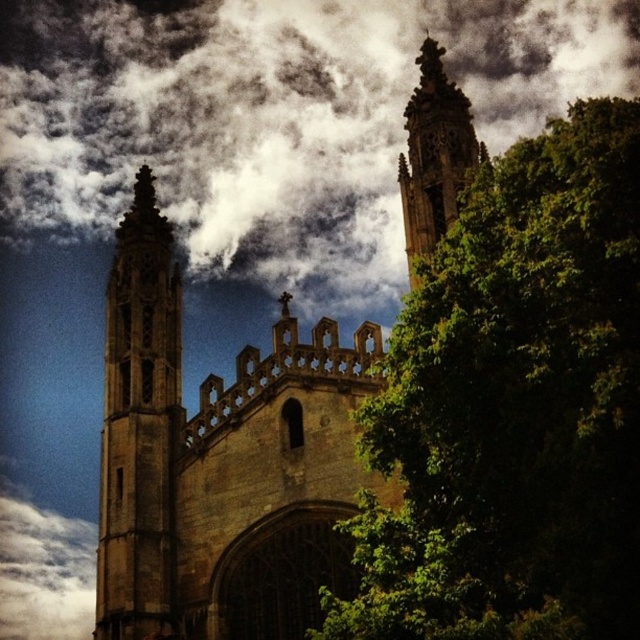
Question: Is white fluffy cloud at upper center bigger than green leafy tree at right?

Choices:
 (A) yes
 (B) no

Answer: (B)

Question: Is brown stone church at center positioned before brown stone tower at left?

Choices:
 (A) no
 (B) yes

Answer: (B)

Question: Which point is farther to the camera?

Choices:
 (A) (420, 356)
 (B) (422, 148)
 (C) (177, 404)

Answer: (C)

Question: Is brown stone church at center in front of brown stone tower at upper center?

Choices:
 (A) yes
 (B) no

Answer: (B)

Question: Among these objects, which one is farthest from the camera?

Choices:
 (A) brown stone tower at left
 (B) green leafy tree at right
 (C) white fluffy cloud at upper center

Answer: (C)

Question: Which point appears farthest from the camera in this image?

Choices:
 (A) (408, 147)
 (B) (480, 344)
 (C) (516, 54)

Answer: (C)